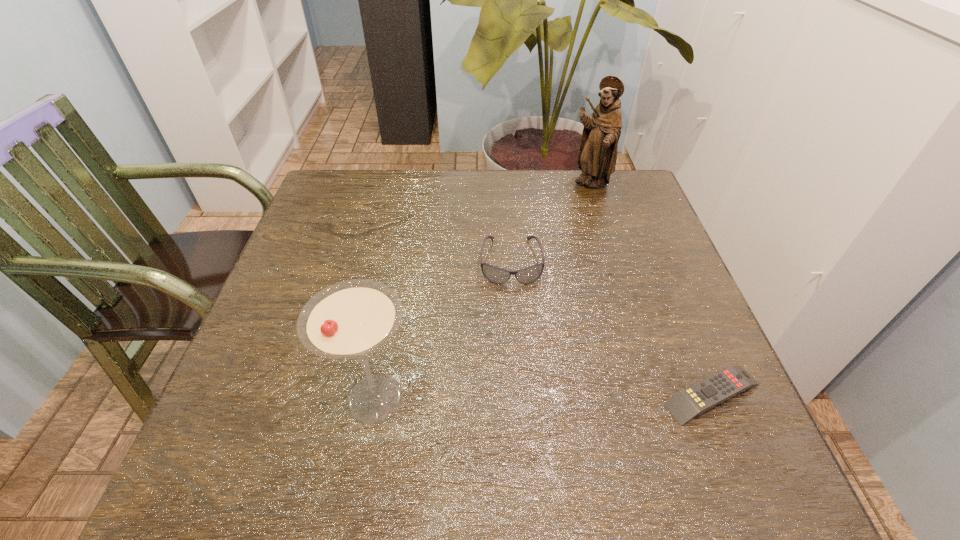
Image resolution: width=960 pixels, height=540 pixels. I want to click on object that ranks as the second closest to the martini, so click(712, 391).

This screenshot has height=540, width=960. In order to click on free location that satisfies the following two spatial constraints: 1. on the back side of the leftmost object; 2. on the left side of the farthest object in this screenshot , I will do `click(416, 184)`.